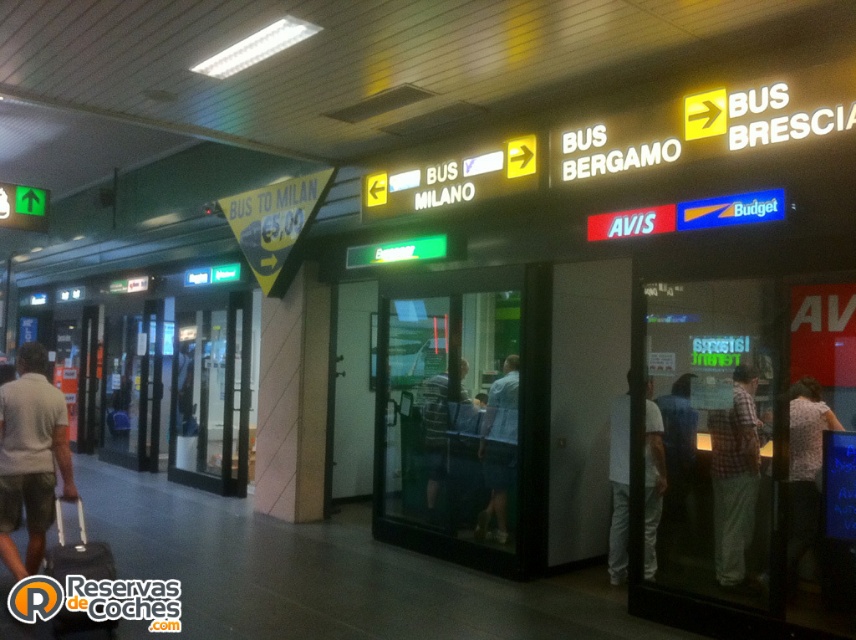
You are standing in the transportation hub and need to retrieve your black fabric suitcase at lower left. There is a plaid shirt at center blocking your path. Can you walk around it to reach the suitcase?

The plaid shirt at center is further to the viewer than the black fabric suitcase at lower left, meaning the plaid shirt is closer to you. Since the plaid shirt is blocking your path, you would need to move around it to reach the suitcase.

Consider the image. You are a traveler at the transportation hub and see a gray cotton shirt at lower left and a striped shirt at center. Which shirt is taller?

The gray cotton shirt at lower left is taller than striped shirt at center.